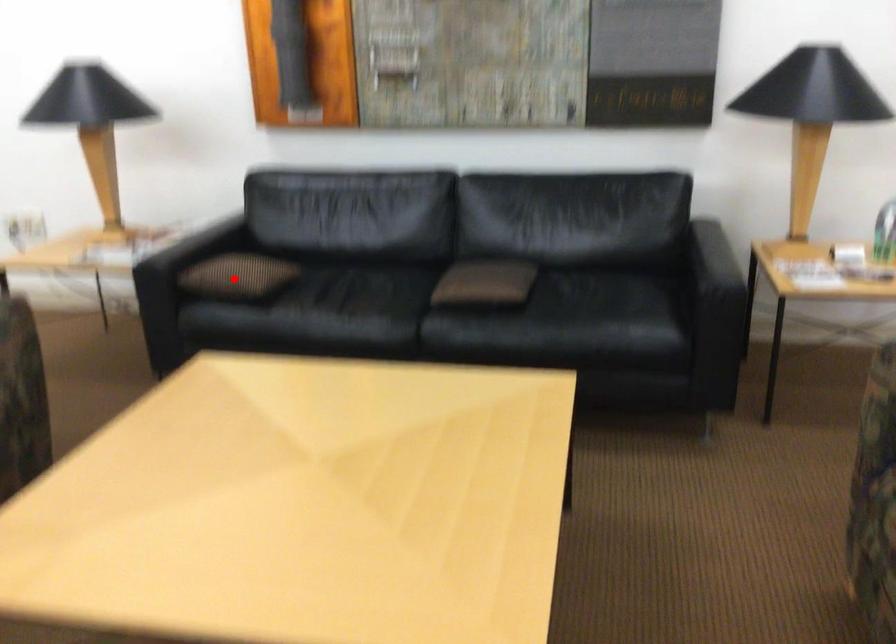
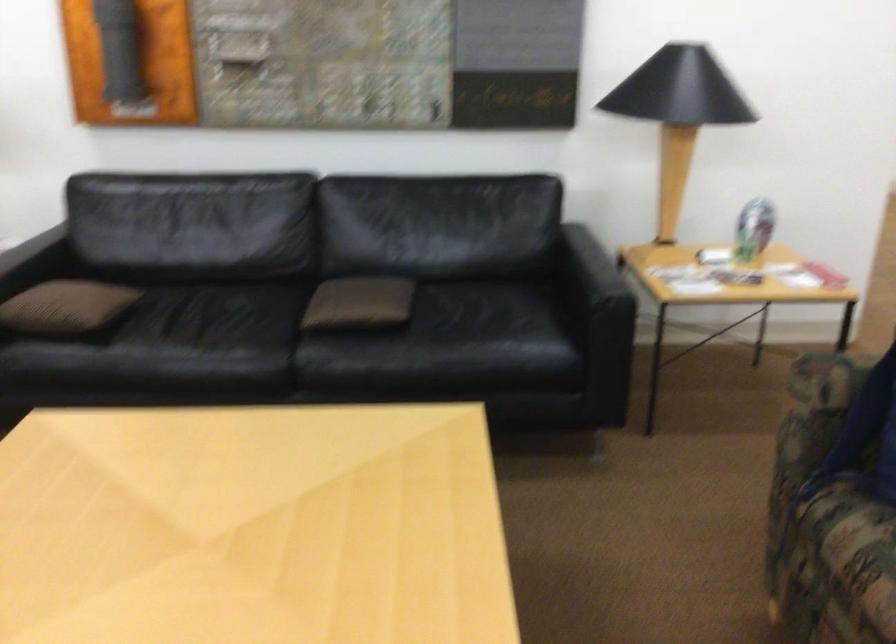
Question: A red point is marked in image1. In image2, is the corresponding 3D point closer to the camera or farther? Reply with the corresponding letter.

Choices:
 (A) The corresponding 3D point is closer.
 (B) The corresponding 3D point is farther.

Answer: (A)